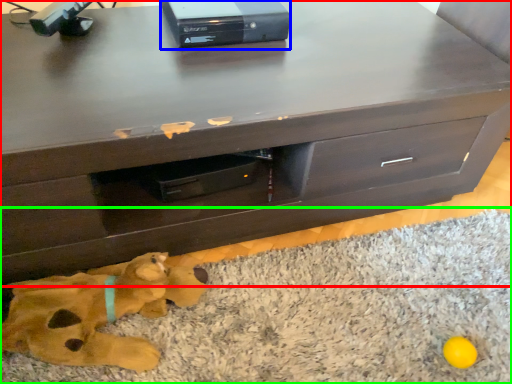
Question: Estimate the real-world distances between objects in this image. Which object is closer to chest of drawers (highlighted by a red box), equipment (highlighted by a blue box) or mat (highlighted by a green box)?

Choices:
 (A) equipment
 (B) mat

Answer: (A)